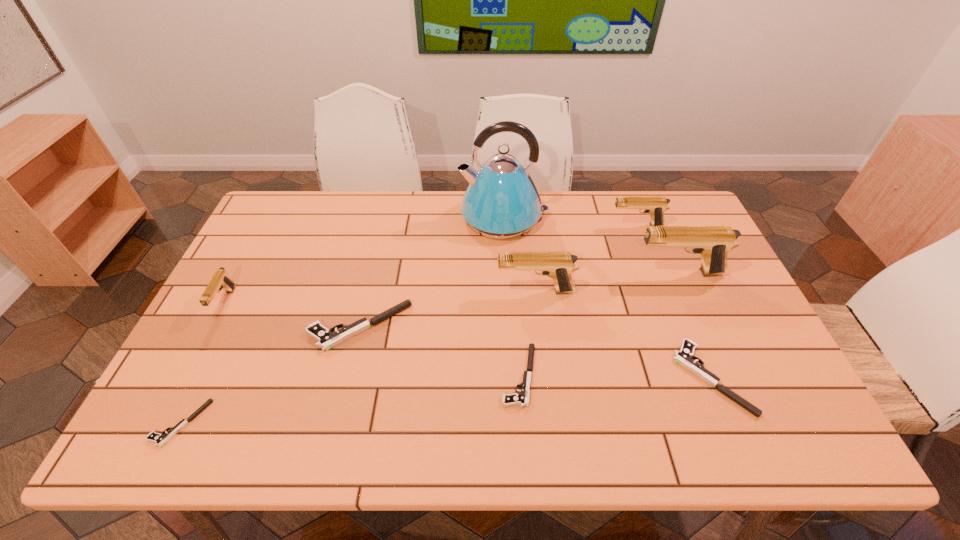
At what (x,y) coordinates should I click in order to perform the action: click on vacant region located 0.280m on the front-facing side of the third pistol from left to right. Please return your answer as a coordinate pair (x, y). Looking at the image, I should click on (205, 326).

At what (x,y) coordinates should I click in order to perform the action: click on free spot located on the front-facing side of the third pistol from left to right. Please return your answer as a coordinate pair (x, y). Looking at the image, I should click on (257, 326).

The image size is (960, 540). Identify the location of free point located 0.180m on the front-facing side of the third pistol from left to right. (243, 326).

The height and width of the screenshot is (540, 960). I want to click on free space located on the front-facing side of the rightmost black pistol, so click(592, 377).

I want to click on vacant region located on the front-facing side of the rightmost black pistol, so click(x=658, y=377).

What are the coordinates of `vacant area situated on the front-facing side of the rightmost black pistol` in the screenshot? It's located at coord(547,377).

Find the location of a particular element. This screenshot has width=960, height=540. vacant space situated on the front-facing side of the third biggest black pistol is located at coordinates click(415, 376).

You are a GUI agent. You are given a task and a screenshot of the screen. Output one action in this format:
    pyautogui.click(x=<x>, y=<y>)
    Task: Click on the vacant space situated on the front-facing side of the third biggest black pistol
    This screenshot has width=960, height=540.
    Given the screenshot: What is the action you would take?
    pyautogui.click(x=382, y=376)

Locate an element on the screen. This screenshot has height=540, width=960. vacant region located 0.280m on the front-facing side of the third biggest black pistol is located at coordinates (386, 376).

This screenshot has height=540, width=960. What are the coordinates of `kettle at the far edge` in the screenshot? It's located at (501, 202).